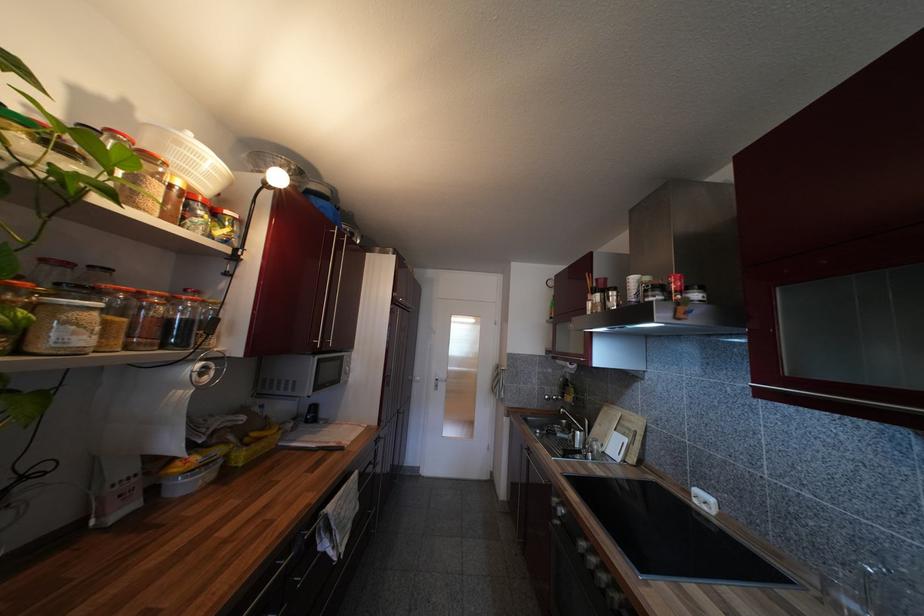
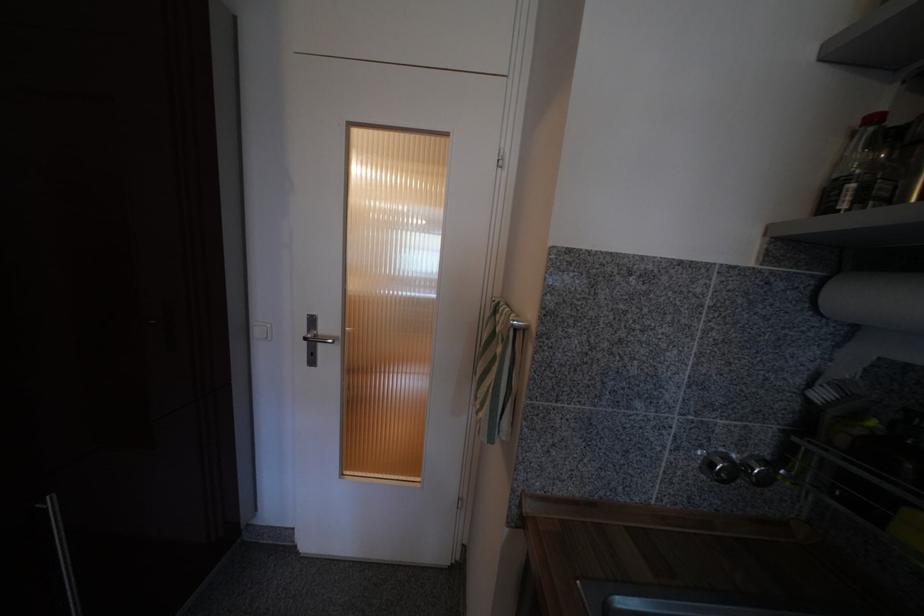
Question: In a continuous first-person perspective shot, in which direction is the camera moving?

Choices:
 (A) Left
 (B) Right
 (C) Forward
 (D) Backward

Answer: (C)